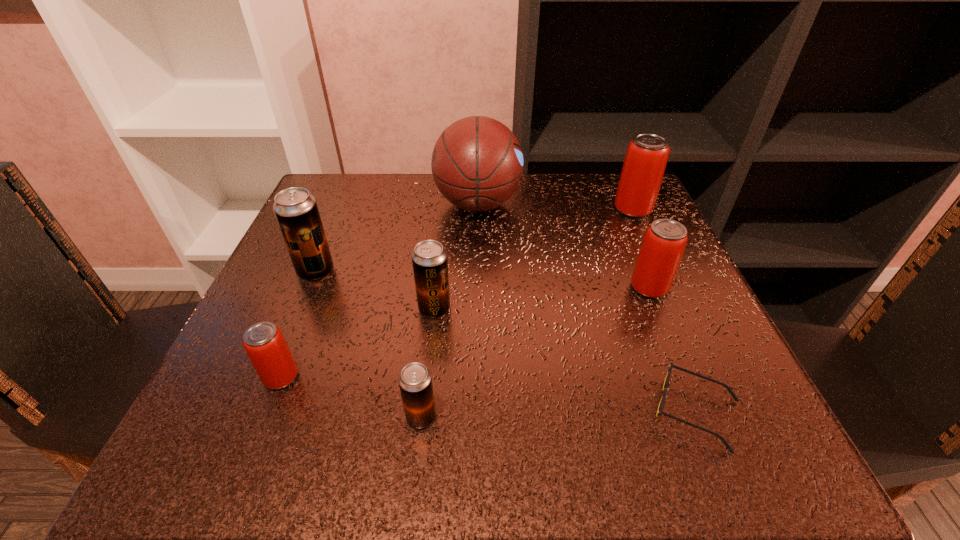
Where is `the nearest black beer can`? The image size is (960, 540). the nearest black beer can is located at coordinates point(415,381).

Locate an element on the screen. Image resolution: width=960 pixels, height=540 pixels. the shortest object is located at coordinates (659, 412).

Image resolution: width=960 pixels, height=540 pixels. I want to click on sunglasses, so click(x=659, y=412).

Identify the location of vacant space located on the left of the basketball. Image resolution: width=960 pixels, height=540 pixels. (x=382, y=204).

This screenshot has width=960, height=540. I want to click on vacant space located on the left of the farthest beer can, so pos(541,210).

Identify the location of vacant space positioned on the back of the farthest black beer can. (337, 221).

You are a GUI agent. You are given a task and a screenshot of the screen. Output one action in this format:
    pyautogui.click(x=<x>, y=<y>)
    Task: Click on the vacant space located 0.180m on the right of the second nearest black beer can
    
    Given the screenshot: What is the action you would take?
    pyautogui.click(x=556, y=309)

The width and height of the screenshot is (960, 540). In order to click on vacant space located 0.150m on the front of the second farthest pink beer can in this screenshot , I will do `click(684, 373)`.

At what (x,y) coordinates should I click in order to perform the action: click on vacant point located 0.070m on the left of the leftmost pink beer can. Please return your answer as a coordinate pair (x, y). This screenshot has height=540, width=960. Looking at the image, I should click on (217, 377).

You are a GUI agent. You are given a task and a screenshot of the screen. Output one action in this format:
    pyautogui.click(x=<x>, y=<y>)
    Task: Click on the vacant space located on the back of the nearest black beer can
    The width and height of the screenshot is (960, 540).
    Given the screenshot: What is the action you would take?
    pyautogui.click(x=438, y=262)